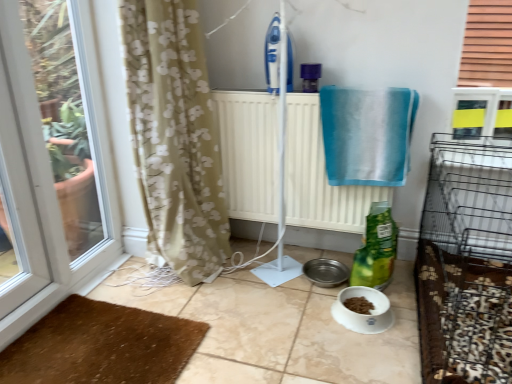
The image size is (512, 384). Describe the element at coordinates (376, 249) in the screenshot. I see `green matte bag at lower center` at that location.

I want to click on green matte bag at lower center, so click(x=376, y=249).

Is blue fabric towel at upper right looking in the opposite direction of green matte bag at lower center?

No, blue fabric towel at upper right is not facing away from green matte bag at lower center.

In the scene shown: Is blue fabric towel at upper right placed right next to green matte bag at lower center?

No.

From the image's perspective, is blue fabric towel at upper right above or below green matte bag at lower center?

Based on their image positions, blue fabric towel at upper right is located above green matte bag at lower center.

Is white radiator at center facing away from green matte bag at lower center?

No, white radiator at center's orientation is not away from green matte bag at lower center.

Which is correct: white radiator at center is inside green matte bag at lower center, or outside of it?

white radiator at center is located beyond the bounds of green matte bag at lower center.

From a real-world perspective, is white radiator at center on green matte bag at lower center?

Correct, in the physical world, white radiator at center is higher than green matte bag at lower center.

Is point (260, 102) closer or farther from the camera than point (373, 234)?

Point (260, 102) is farther from the camera than point (373, 234).

Is brown textured mat at lower left completely or partially inside blue fabric towel at upper right?

Definitely not — brown textured mat at lower left is not inside blue fabric towel at upper right.

Is blue fabric towel at upper right not close to brown textured mat at lower left?

blue fabric towel at upper right is positioned a significant distance from brown textured mat at lower left.

Considering the positions of objects blue fabric towel at upper right and brown textured mat at lower left in the image provided, who is in front, blue fabric towel at upper right or brown textured mat at lower left?

brown textured mat at lower left is closer to the camera.

Is point (382, 120) more distant than point (155, 372)?

Yes, it is behind point (155, 372).

From a real-world perspective, is blue fabric towel at upper right physically located above or below transparent glass window at left?

From a real-world perspective, blue fabric towel at upper right is physically above transparent glass window at left.

Which object is thinner, blue fabric towel at upper right or transparent glass window at left?

A: Thinner between the two is transparent glass window at left.

Is blue fabric towel at upper right in front of transparent glass window at left?

No, blue fabric towel at upper right is further to the viewer.

In terms of width, does transparent glass window at left look wider or thinner when compared to green matte bag at lower center?

Clearly, transparent glass window at left has less width compared to green matte bag at lower center.

From the image's perspective, which one is positioned higher, transparent glass window at left or green matte bag at lower center?

transparent glass window at left appears higher in the image.

Does transparent glass window at left contain green matte bag at lower center?

That's incorrect, green matte bag at lower center is not inside transparent glass window at left.

In terms of size, does white radiator at center appear bigger or smaller than blue fabric towel at upper right?

Clearly, white radiator at center is larger in size than blue fabric towel at upper right.

Is white radiator at center to the left of blue fabric towel at upper right from the viewer's perspective?

Yes, white radiator at center is to the left of blue fabric towel at upper right.

From the image's perspective, is white radiator at center on blue fabric towel at upper right?

No, from the image's perspective, white radiator at center is not over blue fabric towel at upper right.

Is blue fabric towel at upper right located within white radiator at center?

Absolutely, blue fabric towel at upper right is inside white radiator at center.

Consider the image. From their relative heights in the image, would you say brown textured mat at lower left is taller or shorter than green matte bag at lower center?

Considering their sizes, brown textured mat at lower left has less height than green matte bag at lower center.

Can you see brown textured mat at lower left touching green matte bag at lower center?

No, brown textured mat at lower left is not next to green matte bag at lower center.

Looking at this image, from the image's perspective, relative to green matte bag at lower center, is brown textured mat at lower left above or below?

From the image's perspective, brown textured mat at lower left appears below green matte bag at lower center.

Considering the positions of points (180, 347) and (372, 273), is point (180, 347) farther from camera compared to point (372, 273)?

No, it is in front of (372, 273).

What are the coordinates of `bottle on the right of blue fabric towel at upper right` in the screenshot? It's located at (376, 249).

The image size is (512, 384). I want to click on bottle that is in front of the white radiator at center, so click(x=376, y=249).

Considering their positions, is white radiator at center positioned closer to transparent glass window at left than brown textured mat at lower left?

Based on the image, brown textured mat at lower left appears to be nearer to transparent glass window at left.

Looking at this image, which object lies further to the anchor point brown textured mat at lower left, green matte bag at lower center or transparent glass window at left?

green matte bag at lower center.

Looking at the image, which one is located closer to white radiator at center, brown textured mat at lower left or transparent glass window at left?

Among the two, transparent glass window at left is located nearer to white radiator at center.

When comparing their distances from white radiator at center, does blue fabric towel at upper right or green matte bag at lower center seem further?

green matte bag at lower center lies further to white radiator at center than the other object.

Based on their spatial positions, is green matte bag at lower center or transparent glass window at left further from blue fabric towel at upper right?

Based on the image, transparent glass window at left appears to be further to blue fabric towel at upper right.

Estimate the real-world distances between objects in this image. Which object is further from transparent glass window at left, blue fabric towel at upper right or green matte bag at lower center?

green matte bag at lower center is further to transparent glass window at left.

Which object lies further to the anchor point white radiator at center, transparent glass window at left or brown textured mat at lower left?

Based on the image, brown textured mat at lower left appears to be further to white radiator at center.

Looking at the image, which one is located further to blue fabric towel at upper right, white radiator at center or green matte bag at lower center?

green matte bag at lower center is further to blue fabric towel at upper right.

In order to click on bath towel between brown textured mat at lower left and green matte bag at lower center in this screenshot , I will do `click(367, 135)`.

In order to click on radiator between brown textured mat at lower left and green matte bag at lower center from left to right in this screenshot , I will do `click(319, 176)`.

Image resolution: width=512 pixels, height=384 pixels. Identify the location of radiator located between transparent glass window at left and green matte bag at lower center in the left-right direction. [319, 176].

Find the location of a particular element. The height and width of the screenshot is (384, 512). radiator between brown textured mat at lower left and blue fabric towel at upper right in the horizontal direction is located at coordinates (319, 176).